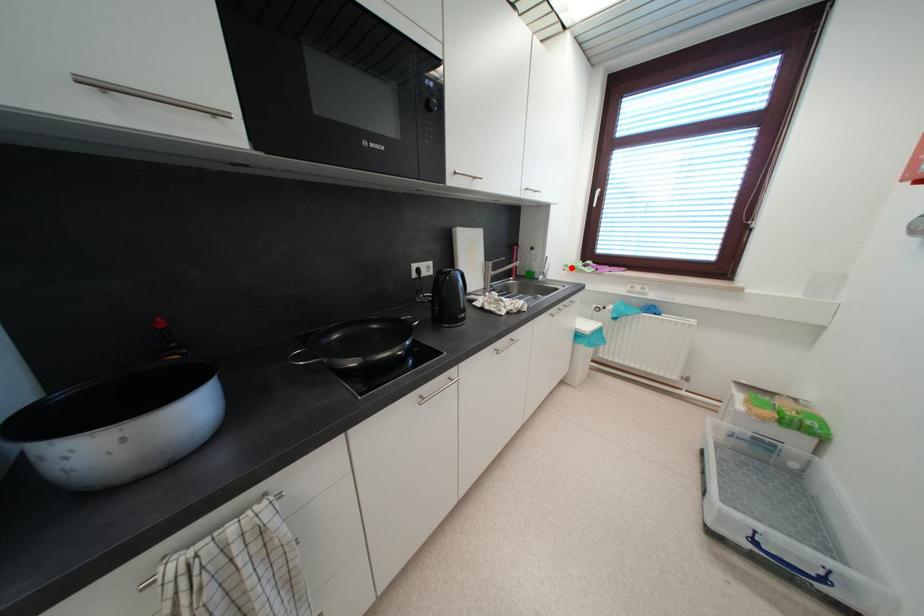
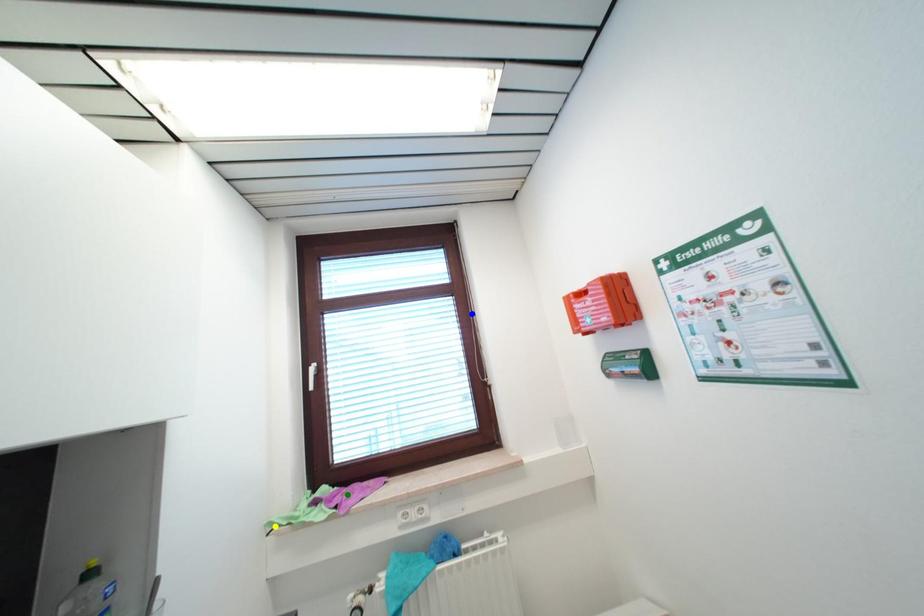
Question: I am providing you with two images of the same scene from different viewpoints. A red point is marked on the first image. You are given multiple points on the second image. Which mark in image 2 goes with the point in image 1?

Choices:
 (A) blue point
 (B) green point
 (C) yellow point

Answer: (C)